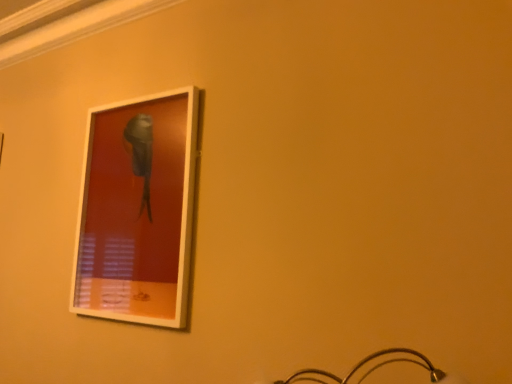
From the picture: In order to face white glossy picture frame at upper left, should I rotate leftwards or rightwards?

Turn left approximately 16.397 degrees to face it.

What do you see at coordinates (137, 210) in the screenshot? I see `white glossy picture frame at upper left` at bounding box center [137, 210].

In order to click on white glossy picture frame at upper left in this screenshot , I will do `click(137, 210)`.

You are a GUI agent. You are given a task and a screenshot of the screen. Output one action in this format:
    pyautogui.click(x=<x>, y=<y>)
    Task: Click on the white glossy picture frame at upper left
    This screenshot has width=512, height=384.
    Given the screenshot: What is the action you would take?
    pyautogui.click(x=137, y=210)